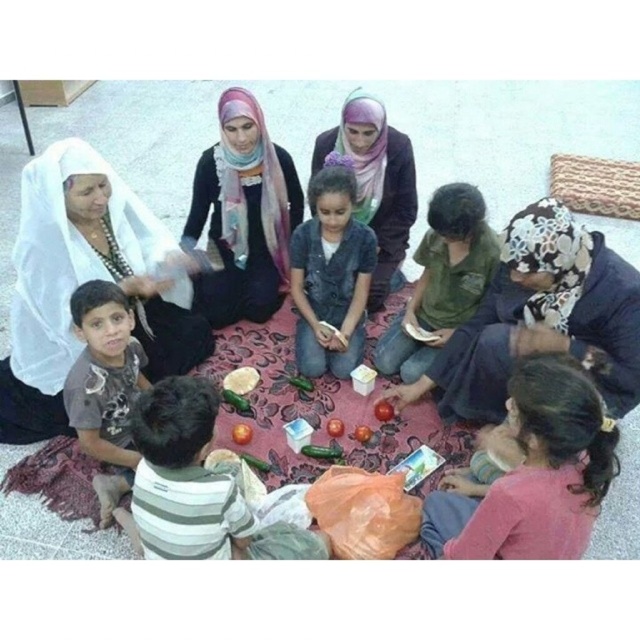
Question: Which object appears farthest from the camera in this image?

Choices:
 (A) red matte tomato at center
 (B) white sheer cloth at left
 (C) matte purple scarf at center

Answer: (C)

Question: Can you confirm if floral-patterned fabric at lower right is wider than green matte shirt at center?

Choices:
 (A) no
 (B) yes

Answer: (B)

Question: Is pink fabric at lower right above matte pink scarf at center?

Choices:
 (A) no
 (B) yes

Answer: (A)

Question: Which point appears closest to the camera in this image?

Choices:
 (A) (337, 422)
 (B) (328, 156)

Answer: (A)

Question: Can you confirm if white sheer cloth at left is smaller than matte pink scarf at center?

Choices:
 (A) yes
 (B) no

Answer: (B)

Question: Which object is positioned closest to the striped cotton shirt at lower left?

Choices:
 (A) dark brown cotton shirt at lower left
 (B) smooth red apple at center
 (C) shiny red tomato at center

Answer: (A)